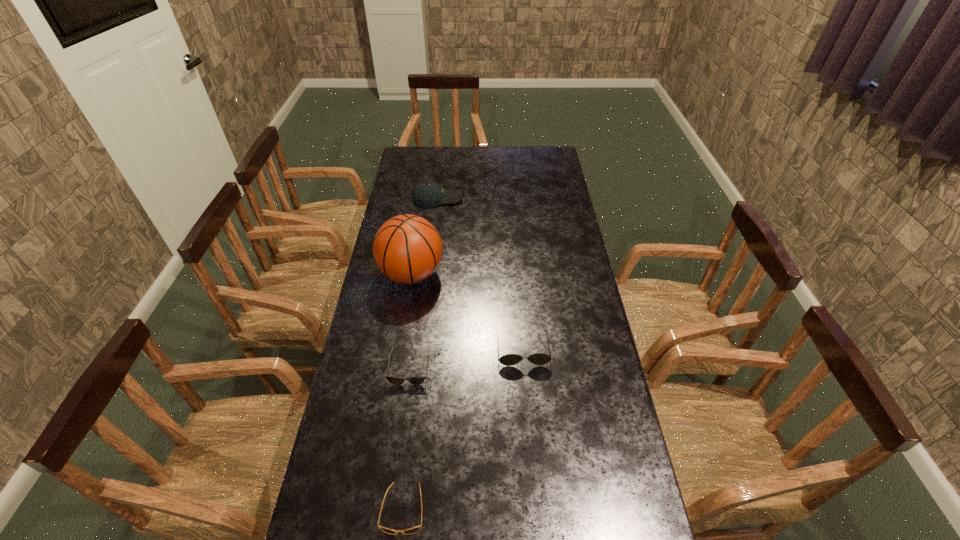
Identify the location of basketball. This screenshot has height=540, width=960. (407, 248).

I want to click on the tallest object, so click(x=407, y=248).

At what (x,y) coordinates should I click in order to perform the action: click on the fourth shortest object. Please return your answer as a coordinate pair (x, y). This screenshot has width=960, height=540. Looking at the image, I should click on (428, 194).

I want to click on baseball cap, so click(428, 194).

Where is `the tallest sunglasses`? This screenshot has width=960, height=540. the tallest sunglasses is located at coordinates (510, 359).

The image size is (960, 540). I want to click on the rightmost sunglasses, so click(510, 359).

This screenshot has height=540, width=960. Find the location of `the nearest sunglasses`. the nearest sunglasses is located at coordinates (413, 530).

Where is `vacant space located 0.240m on the front of the tallest object`? The image size is (960, 540). vacant space located 0.240m on the front of the tallest object is located at coordinates (399, 356).

Locate an element on the screen. free space located on the front-facing side of the baseball cap is located at coordinates (517, 198).

Find the location of `blank area located on the front-facing side of the rightmost sunglasses`. blank area located on the front-facing side of the rightmost sunglasses is located at coordinates (529, 422).